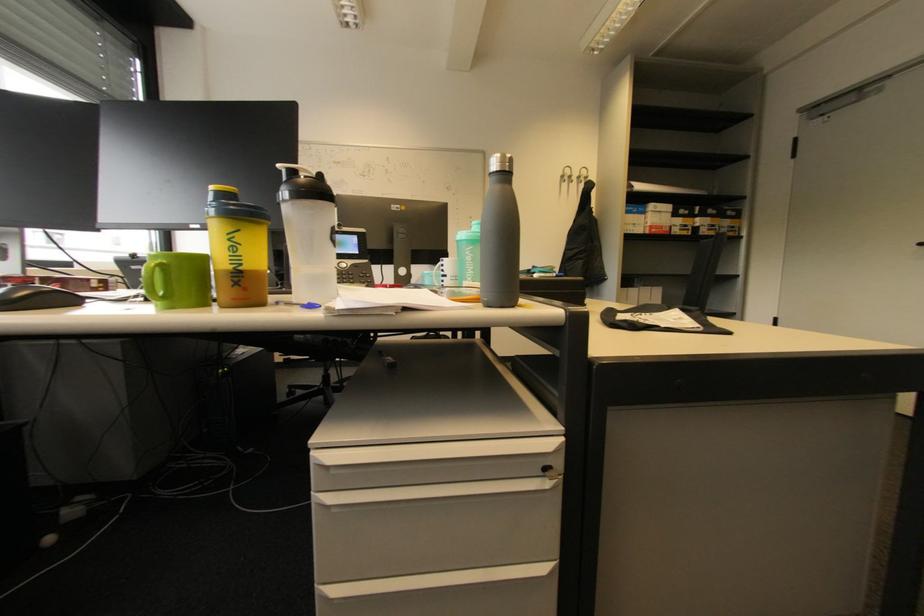
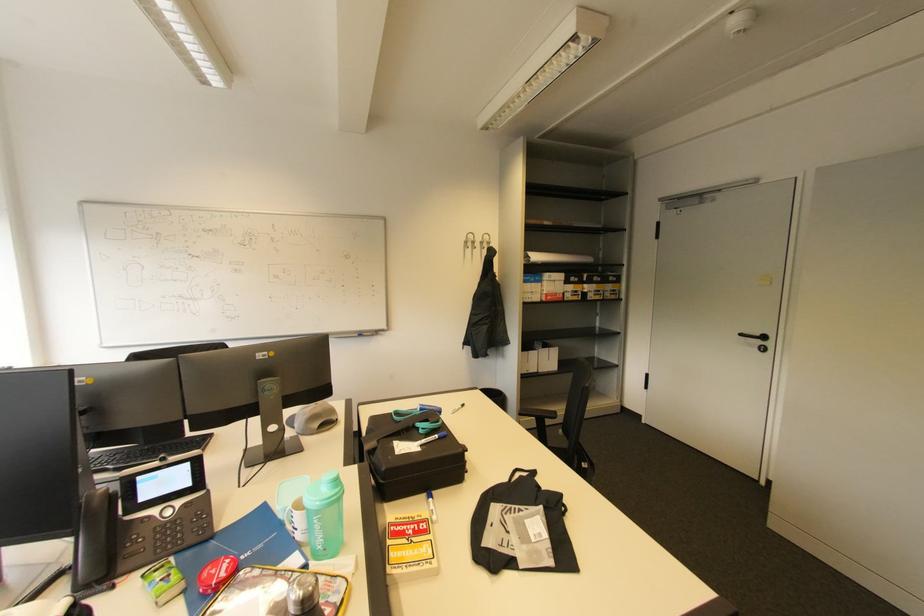
The point at (472, 254) is marked in the first image. Where is the corresponding point in the second image?

(320, 522)